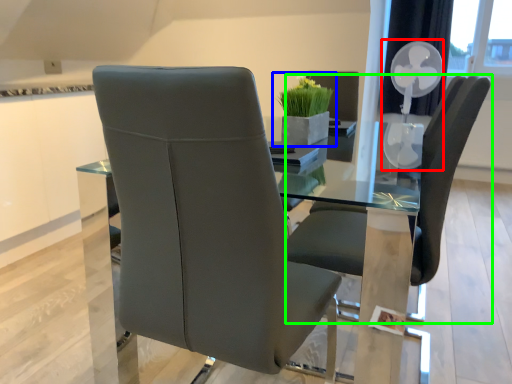
Question: Estimate the real-world distances between objects in this image. Which object is closer to fan (highlighted by a red box), houseplant (highlighted by a blue box) or chair (highlighted by a green box)?

Choices:
 (A) houseplant
 (B) chair

Answer: (A)